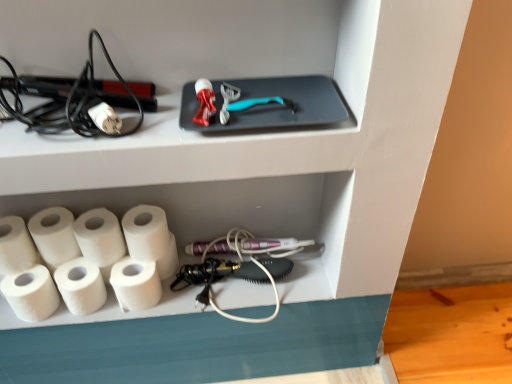
Question: From a real-world perspective, is black plastic hair straightener at left positioned above or below white matte paper towel at lower left, marked as the fourth paper towel in a right-to-left arrangement?

Choices:
 (A) below
 (B) above

Answer: (B)

Question: In the image, is black plastic hair straightener at left positioned in front of or behind white matte paper towel at lower left, marked as the fourth paper towel in a right-to-left arrangement?

Choices:
 (A) front
 (B) behind

Answer: (A)

Question: Estimate the real-world distances between objects in this image. Which object is closer to the white matte toilet paper rolls at lower left?

Choices:
 (A) white matte paper towel at lower left, positioned as the first paper towel in left-to-right order
 (B) white matte paper towel at lower left, placed as the sixth paper towel when sorted from left to right
 (C) white matte paper towel at lower left, acting as the 2th paper towel starting from the left
 (D) white matte paper towel at lower left, the first paper towel when ordered from right to left
 (E) white matte paper towel at lower left, the 3th paper towel from the left

Answer: (D)

Question: Estimate the real-world distances between objects in this image. Which object is farther from the white matte paper towel at lower left, positioned as the first paper towel in left-to-right order?

Choices:
 (A) white matte paper towel at lower left, which ranks as the fifth paper towel in right-to-left order
 (B) white matte paper towel at lower left, positioned as the seventh paper towel in left-to-right order
 (C) white matte toilet paper rolls at lower left
 (D) white matte paper towel at lower left, acting as the 2th paper towel starting from the left
 (E) black plastic hair straightener at left

Answer: (C)